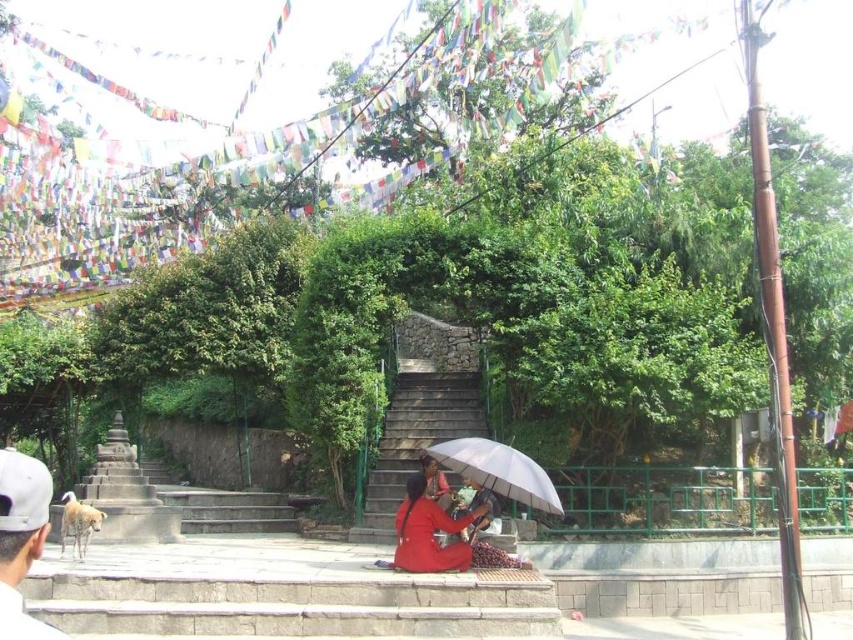
Question: Does stone stairs at center appear over red fabric umbrella at lower center?

Choices:
 (A) yes
 (B) no

Answer: (A)

Question: Is stone stairs at center thinner than white cap at lower left?

Choices:
 (A) no
 (B) yes

Answer: (B)

Question: Among these points, which one is nearest to the camera?

Choices:
 (A) (416, 506)
 (B) (518, 477)

Answer: (B)

Question: Which object is positioned farthest from the stone stairs at center?

Choices:
 (A) transparent plastic umbrella at center
 (B) white cap at lower left
 (C) red fabric umbrella at lower center

Answer: (B)

Question: Considering the real-world distances, which object is farthest from the white cap at lower left?

Choices:
 (A) transparent plastic umbrella at center
 (B) red fabric umbrella at lower center
 (C) stone stairs at center

Answer: (C)

Question: Is stone stairs at center bigger than transparent plastic umbrella at center?

Choices:
 (A) no
 (B) yes

Answer: (B)